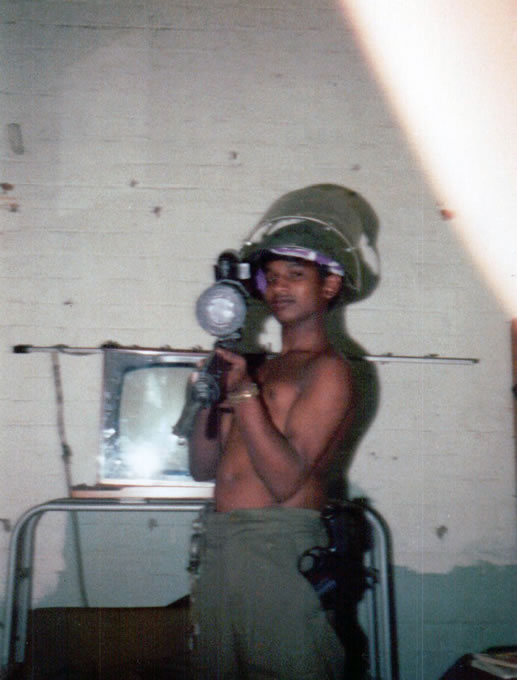
You are a GUI agent. You are given a task and a screenshot of the screen. Output one action in this format:
    pyautogui.click(x=<x>, y=<y>)
    Task: Click on the blue color on wall
    
    Given the screenshot: What is the action you would take?
    pyautogui.click(x=446, y=590)